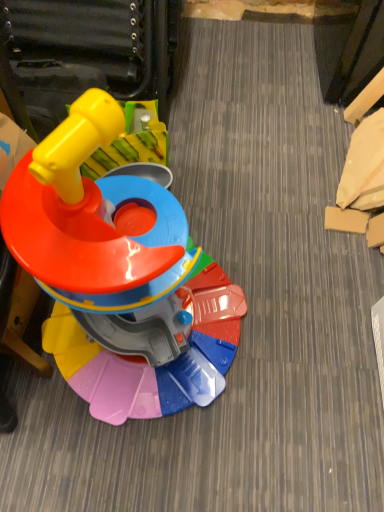
The height and width of the screenshot is (512, 384). I want to click on shiny plastic toy at center, so click(x=119, y=275).

In order to face shiny plastic toy at center, should I rotate leftwards or rightwards?

You should look left and rotate roughly 8.952 degrees.

Measure the distance between point (99,292) and camera.

A distance of 25.83 inches exists between point (99,292) and camera.

What do you see at coordinates (119, 275) in the screenshot? This screenshot has height=512, width=384. I see `shiny plastic toy at center` at bounding box center [119, 275].

At what (x,y) coordinates should I click in order to perform the action: click on shiny plastic toy at center. Please return your answer as a coordinate pair (x, y). Looking at the image, I should click on (119, 275).